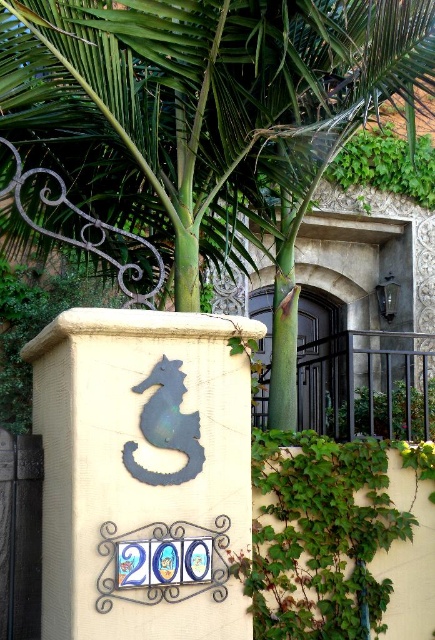
Is green leafy palm tree at center taller than black wrought iron gate at center?

Indeed, green leafy palm tree at center has a greater height compared to black wrought iron gate at center.

Does green leafy palm tree at center appear on the right side of black wrought iron gate at center?

No, green leafy palm tree at center is not to the right of black wrought iron gate at center.

At what (x,y) coordinates should I click in order to perform the action: click on green leafy palm tree at center. Please return your answer as a coordinate pair (x, y). Image resolution: width=435 pixels, height=640 pixels. Looking at the image, I should click on click(210, 115).

Locate an element on the screen. The image size is (435, 640). green leafy palm tree at center is located at coordinates (210, 115).